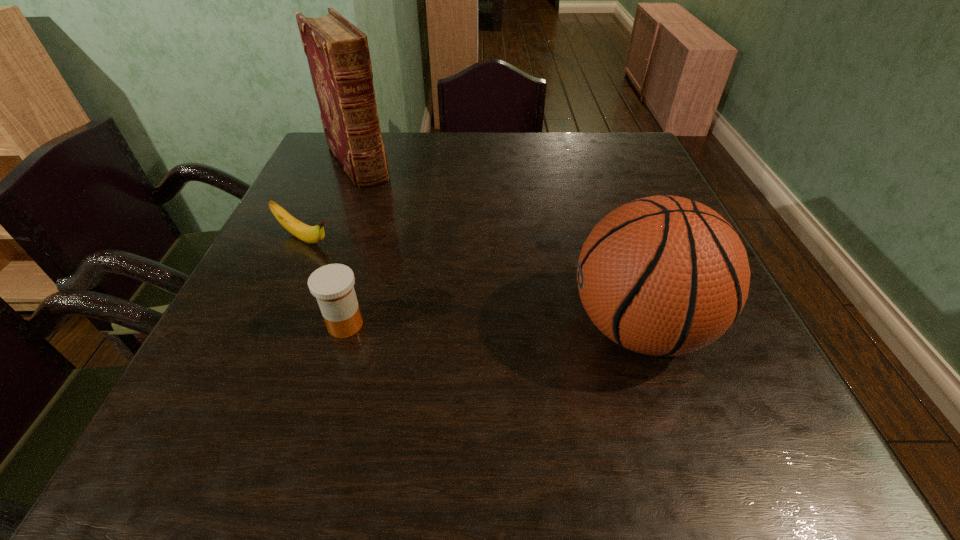
Choose which object is the third nearest neighbor to the medicine. Please provide its 2D coordinates. Your answer should be formatted as a tuple, i.e. [(x, y)], where the tuple contains the x and y coordinates of a point satisfying the conditions above.

[(338, 56)]

Identify the location of free space in the image that satisfies the following two spatial constraints: 1. on the label of the second shortest object; 2. on the side where the inflation valve is located. The width and height of the screenshot is (960, 540). (345, 327).

In order to click on vacant space that satisfies the following two spatial constraints: 1. on the front side of the second farthest object; 2. on the side where the inflation valve is located in this screenshot , I will do `click(265, 327)`.

You are a GUI agent. You are given a task and a screenshot of the screen. Output one action in this format:
    pyautogui.click(x=<x>, y=<y>)
    Task: Click on the free spot that satisfies the following two spatial constraints: 1. on the label of the medicine; 2. on the side where the inflation valve is located
    The image size is (960, 540).
    Given the screenshot: What is the action you would take?
    pyautogui.click(x=345, y=327)

This screenshot has width=960, height=540. I want to click on vacant space that satisfies the following two spatial constraints: 1. on the front side of the third shortest object; 2. on the side where the inflation valve is located, so click(x=265, y=327).